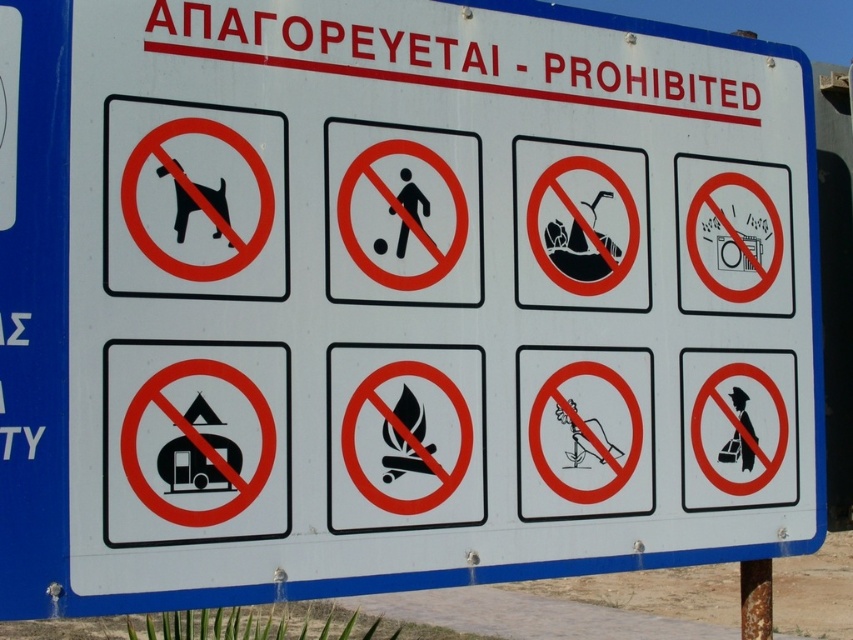
Can you confirm if black plastic dog at upper left is shorter than brown wooden pole at lower right?

No, black plastic dog at upper left is not shorter than brown wooden pole at lower right.

Which of these two, black plastic dog at upper left or brown wooden pole at lower right, stands shorter?

Standing shorter between the two is brown wooden pole at lower right.

Does point (223, 250) come behind point (763, 602)?

That is False.

At what (x,y) coordinates should I click in order to perform the action: click on black plastic dog at upper left. Please return your answer as a coordinate pair (x, y). Looking at the image, I should click on (194, 198).

The image size is (853, 640). I want to click on black plastic soccer ball at center, so click(x=402, y=214).

Is black plastic soccer ball at center closer to the viewer compared to brown wooden pole at lower right?

Yes, it is.

Is point (334, 262) positioned behind point (740, 593)?

No, (334, 262) is in front of (740, 593).

Where is `black plastic soccer ball at center`? This screenshot has height=640, width=853. black plastic soccer ball at center is located at coordinates click(x=402, y=214).

Is black plastic dog at upper left in front of black plastic soccer ball at center?

That is True.

Looking at this image, does black plastic dog at upper left appear under black plastic soccer ball at center?

Incorrect, black plastic dog at upper left is not positioned below black plastic soccer ball at center.

At what (x,y) coordinates should I click in order to perform the action: click on black plastic dog at upper left. Please return your answer as a coordinate pair (x, y). The width and height of the screenshot is (853, 640). Looking at the image, I should click on 194,198.

You are a GUI agent. You are given a task and a screenshot of the screen. Output one action in this format:
    pyautogui.click(x=<x>, y=<y>)
    Task: Click on the black plastic dog at upper left
    
    Given the screenshot: What is the action you would take?
    pyautogui.click(x=194, y=198)